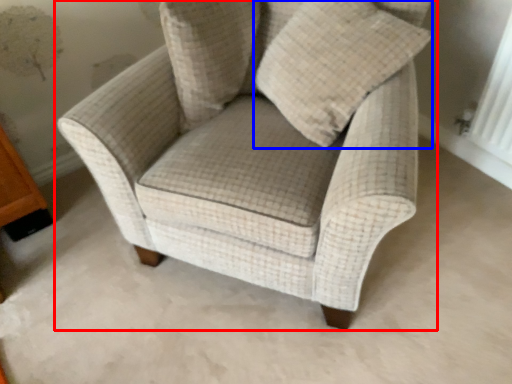
Question: Which point is closer to the camera, chair (highlighted by a red box) or throw pillow (highlighted by a blue box)?

Choices:
 (A) chair
 (B) throw pillow

Answer: (A)